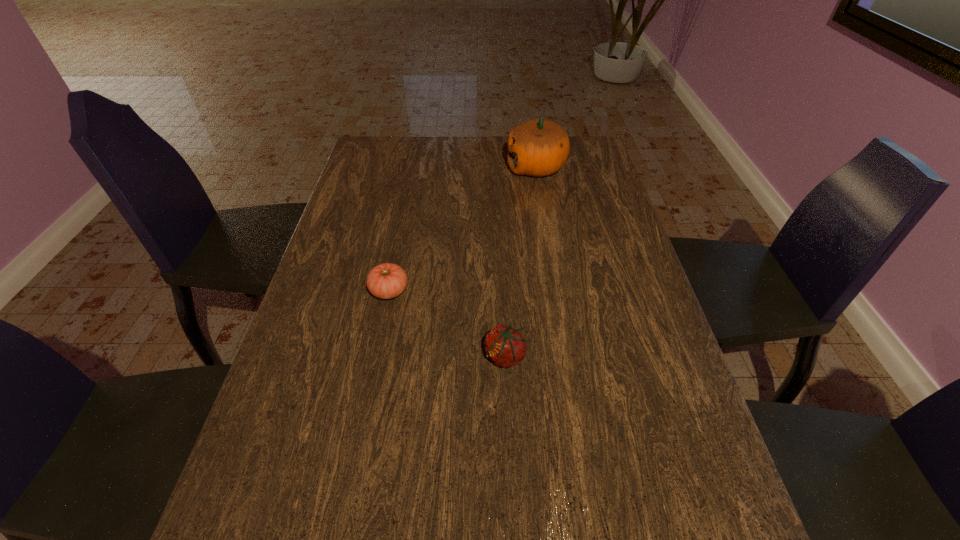
The height and width of the screenshot is (540, 960). In order to click on unoccupied area between the right tomato and the farthest object in this screenshot , I will do `click(520, 262)`.

This screenshot has height=540, width=960. Identify the location of free space that is in between the pumpkin and the nearest object. click(520, 262).

The width and height of the screenshot is (960, 540). Identify the location of vacant area between the farther tomato and the tallest object. (463, 229).

Locate an element on the screen. This screenshot has height=540, width=960. free area in between the nearest object and the left tomato is located at coordinates coord(447,323).

Locate an element on the screen. Image resolution: width=960 pixels, height=540 pixels. vacant space that's between the right tomato and the farthest object is located at coordinates (520, 262).

Identify the location of vacant space that's between the pumpkin and the leftmost object. (463, 229).

Find the location of a particular element. This screenshot has width=960, height=540. vacant area between the left tomato and the farthest object is located at coordinates (463, 229).

At what (x,y) coordinates should I click in order to perform the action: click on free space between the pumpkin and the nearer tomato. Please return your answer as a coordinate pair (x, y). Looking at the image, I should click on (520, 262).

At what (x,y) coordinates should I click in order to perform the action: click on unoccupied area between the nearer tomato and the pumpkin. Please return your answer as a coordinate pair (x, y). The height and width of the screenshot is (540, 960). Looking at the image, I should click on (520, 262).

Image resolution: width=960 pixels, height=540 pixels. What are the coordinates of `object identified as the closest to the nearer tomato` in the screenshot? It's located at (385, 281).